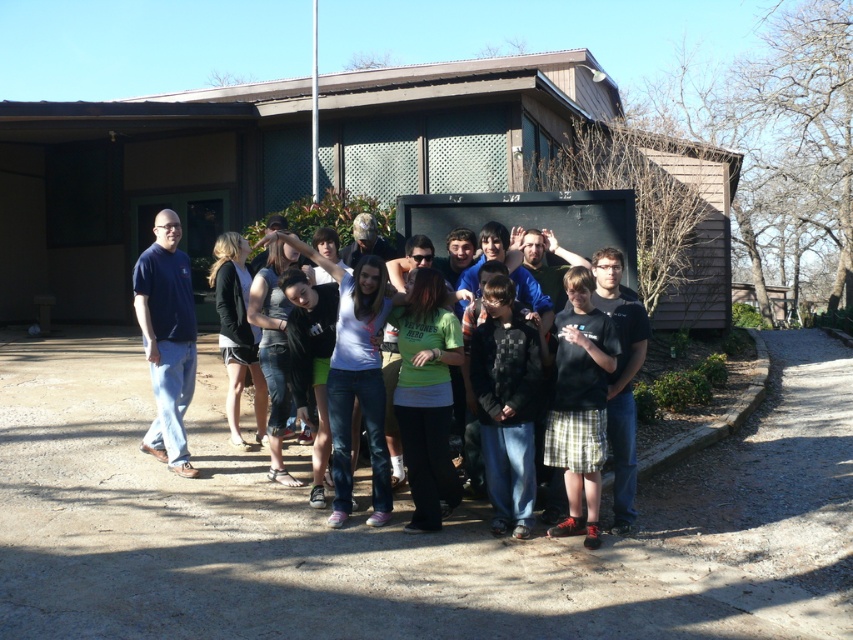
You are standing in front of the building and want to take a photo of the group. Which object, the dark blue jeans at center or the black cotton shirt at center, will appear closer to the camera in the photo?

The dark blue jeans at center will appear closer to the camera in the photo because the black cotton shirt at center is behind it.

You are standing at the center of the paved area in front of the building. There are two points marked in the image. One is at point coordinates (584, 448) and the other at (316, 19). Which point is closer to your current position?

Point (584, 448) is closer to the camera than point (316, 19), so the point at coordinates (584, 448) is closer to your current position.